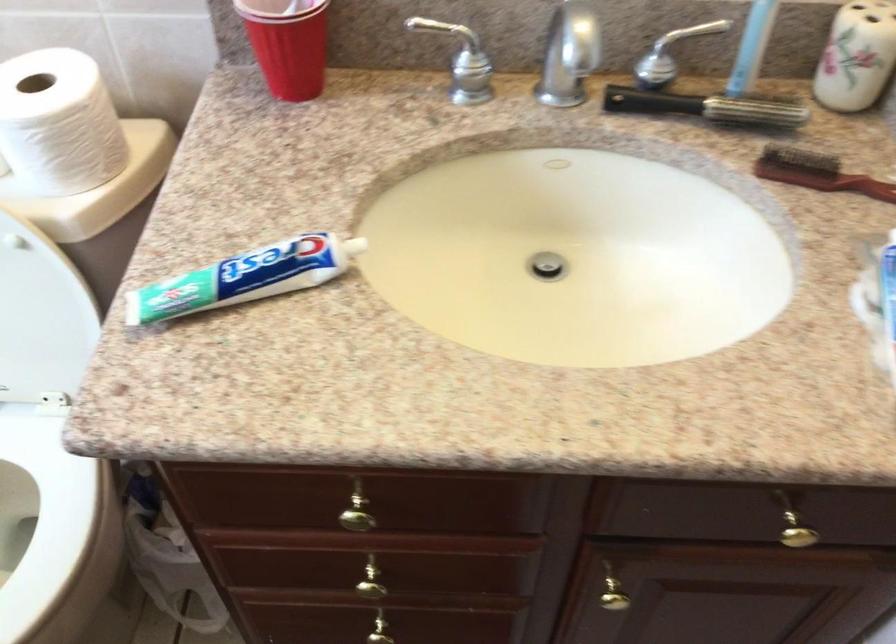
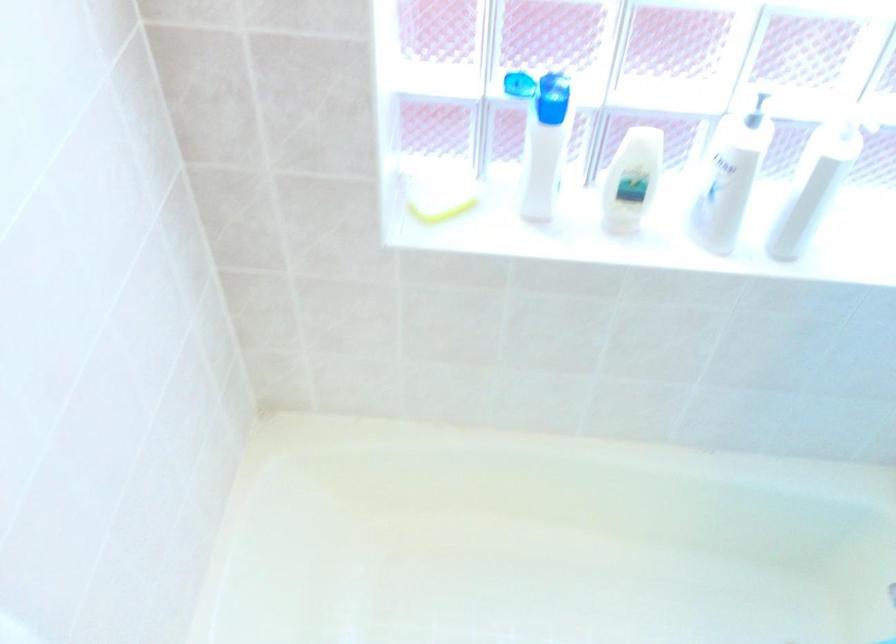
Based on the continuous images, in which direction is the camera rotating?

The camera rotated toward left-down.